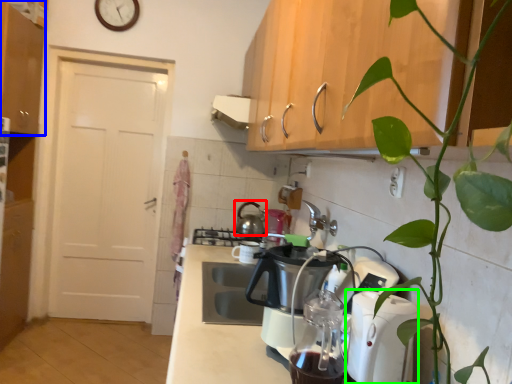
Question: Which object is positioned closest to kitchen appliance (highlighted by a red box)? Select from cabinetry (highlighted by a blue box) and kitchen appliance (highlighted by a green box).

Choices:
 (A) cabinetry
 (B) kitchen appliance

Answer: (A)